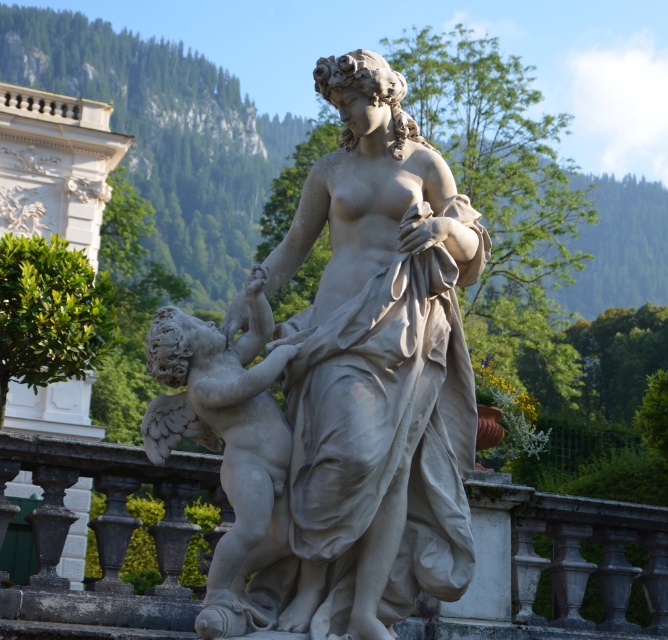
You are an art student analyzing the composition of the scene. Given that both the white marble statue at center and the white marble cherub at center are part of the same sculpture, which one takes up more visual space in the artwork?

The white marble cherub at center takes up more visual space than the white marble statue at center according to the description.

You are an art conservator assessing the placement of the white marble cherub at center and the white stone railing at center in the sculpture. Considering their heights, which object would require a higher platform to ensure both are visible from a standard viewing angle?

The white stone railing at center is much taller than the white marble cherub at center, so the white marble cherub at center would need a higher platform to ensure it is visible above the railing.

You are standing in front of the classical sculpture and want to determine which of the two points, point (335, 83) or point (597, 541), is nearer to you. Based on the sculpture, which point is closer?

Point (335, 83) is closer to the viewer than point (597, 541).